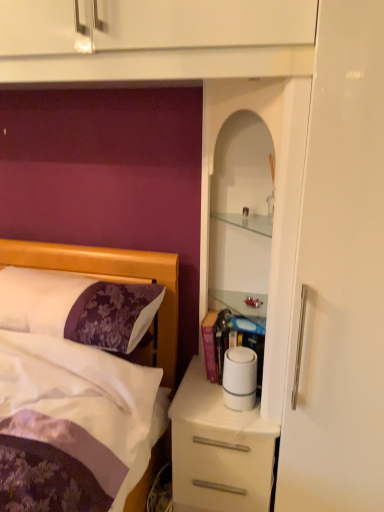
Question: From a real-world perspective, is white glossy cabinet at upper right above or below purple satin pillow at left?

Choices:
 (A) above
 (B) below

Answer: (A)

Question: Do you think white glossy cabinet at upper right is within purple satin pillow at left, or outside of it?

Choices:
 (A) outside
 (B) inside

Answer: (A)

Question: Which of these objects is positioned farthest from the purple satin pillow at left?

Choices:
 (A) white glossy cabinet at upper right
 (B) white glossy desk at center
 (C) white matte toilet paper at center

Answer: (A)

Question: Estimate the real-world distances between objects in this image. Which object is closer to the purple satin pillow at left?

Choices:
 (A) white glossy desk at center
 (B) white glossy cabinet at upper right
 (C) white matte toilet paper at center

Answer: (C)